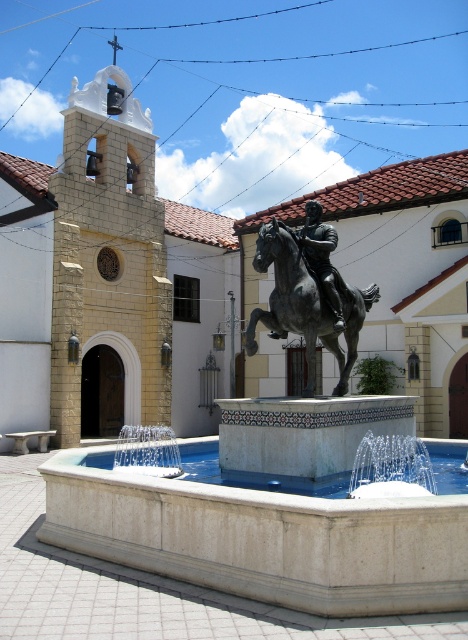
Does light beige stone church at center have a greater width compared to white marble fountain at center?

Yes, light beige stone church at center is wider than white marble fountain at center.

Does light beige stone church at center have a lesser width compared to white marble fountain at center?

No.

The height and width of the screenshot is (640, 468). I want to click on light beige stone church at center, so 205,285.

Does white stone fountain at center have a lesser width compared to bronze metallic horse at center?

Correct, white stone fountain at center's width is less than bronze metallic horse at center's.

Is point (327, 593) closer to viewer compared to point (267, 320)?

Yes, it is.

This screenshot has height=640, width=468. I want to click on white stone fountain at center, so click(276, 500).

Looking at this image, is white stone fountain at center positioned before polished bronze statue at center?

Yes, white stone fountain at center is closer to the viewer.

Can you confirm if white stone fountain at center is positioned below polished bronze statue at center?

Indeed, white stone fountain at center is positioned under polished bronze statue at center.

Does point (195, 580) come behind point (329, 243)?

No, (195, 580) is closer to viewer.

You are a GUI agent. You are given a task and a screenshot of the screen. Output one action in this format:
    pyautogui.click(x=<x>, y=<y>)
    Task: Click on the white stone fountain at center
    The width and height of the screenshot is (468, 640).
    Given the screenshot: What is the action you would take?
    pyautogui.click(x=276, y=500)